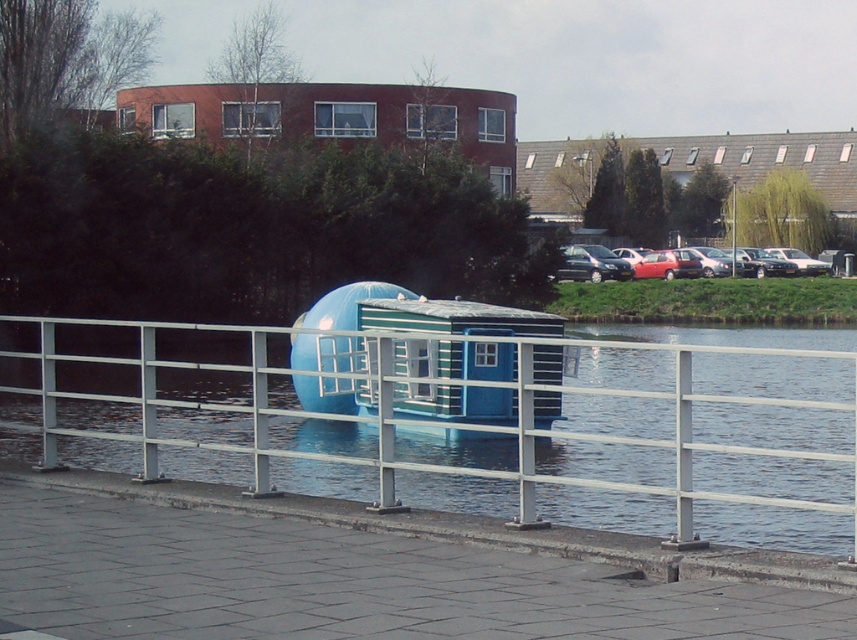
Is point (301, 500) in front of point (706, 397)?

No, (301, 500) is behind (706, 397).

Consider the image. Is gray concrete dock at lower center smaller than metallic silver fence at center?

Indeed, gray concrete dock at lower center has a smaller size compared to metallic silver fence at center.

Is point (454, 611) closer to viewer compared to point (646, 506)?

Yes, point (454, 611) is closer to viewer.

You are a GUI agent. You are given a task and a screenshot of the screen. Output one action in this format:
    pyautogui.click(x=<x>, y=<y>)
    Task: Click on the gray concrete dock at lower center
    Image resolution: width=857 pixels, height=640 pixels.
    Given the screenshot: What is the action you would take?
    pyautogui.click(x=370, y=573)